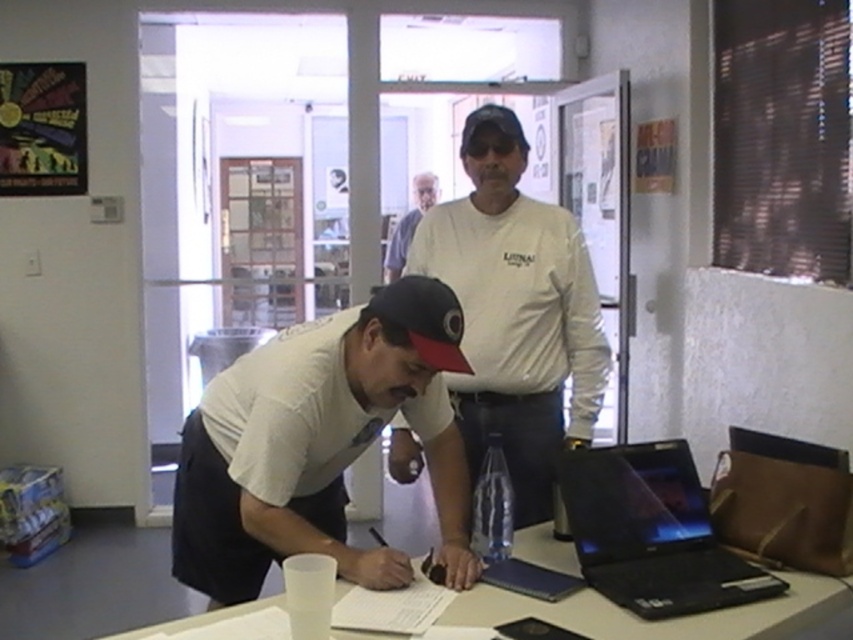
Question: Is white cotton shirt at center to the left of matte black baseball cap at center from the viewer's perspective?

Choices:
 (A) yes
 (B) no

Answer: (B)

Question: Which object is closer to the camera taking this photo?

Choices:
 (A) white cotton shirt at upper center
 (B) black matte laptop at lower right
 (C) matte black baseball cap at center

Answer: (B)

Question: Does white cotton shirt at center appear over white cotton shirt at upper center?

Choices:
 (A) yes
 (B) no

Answer: (B)

Question: Is white matte table at center smaller than white cotton shirt at upper center?

Choices:
 (A) no
 (B) yes

Answer: (B)

Question: Which of the following is the farthest from the observer?

Choices:
 (A) matte black baseball cap at center
 (B) white cotton shirt at center
 (C) black matte laptop at lower right
 (D) white matte shirt at center

Answer: (B)

Question: Which object appears closest to the camera in this image?

Choices:
 (A) matte black baseball cap at center
 (B) white cotton shirt at upper center
 (C) white matte shirt at center
 (D) black matte laptop at lower right

Answer: (D)